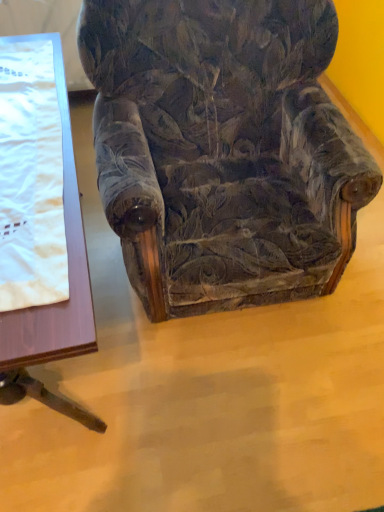
The width and height of the screenshot is (384, 512). What are the coordinates of `empty space that is in between velvet floral-patterned armchair at center and wooden table at left` in the screenshot? It's located at (200, 358).